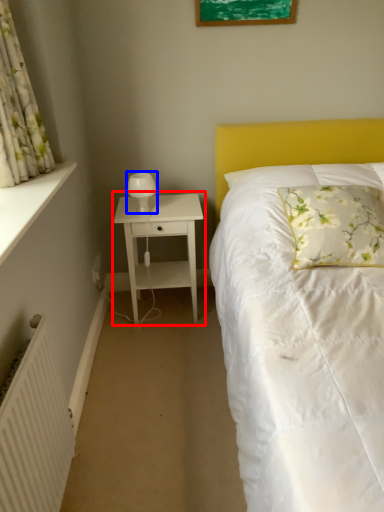
Question: Which of the following is the farthest to the observer, nightstand (highlighted by a red box) or bedside lamp (highlighted by a blue box)?

Choices:
 (A) nightstand
 (B) bedside lamp

Answer: (B)